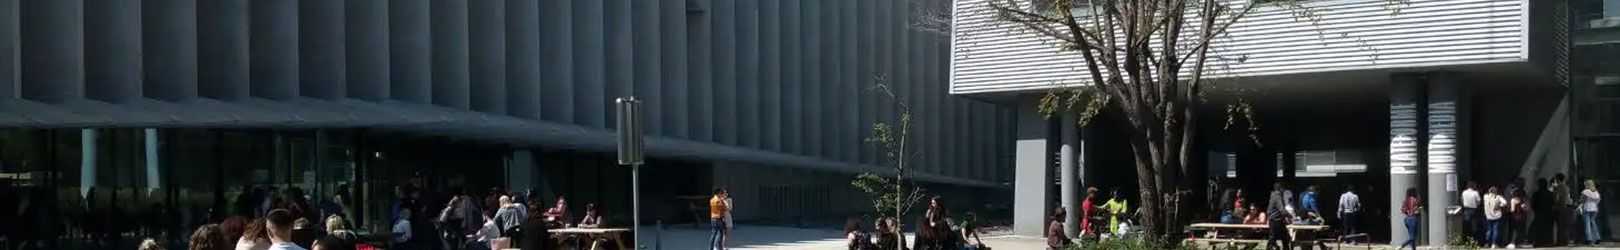
The image size is (1620, 250). Identify the location of benches. (612, 226), (1200, 223).